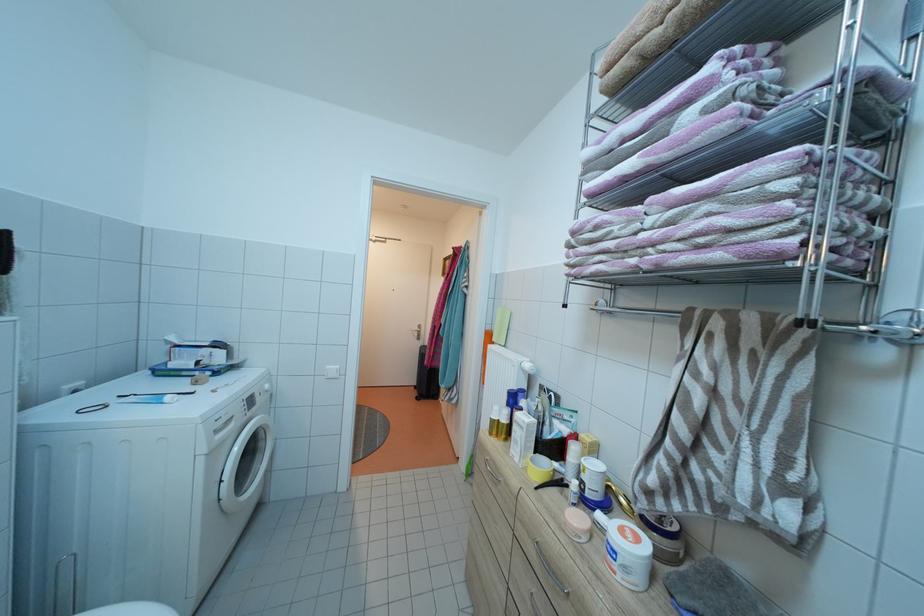
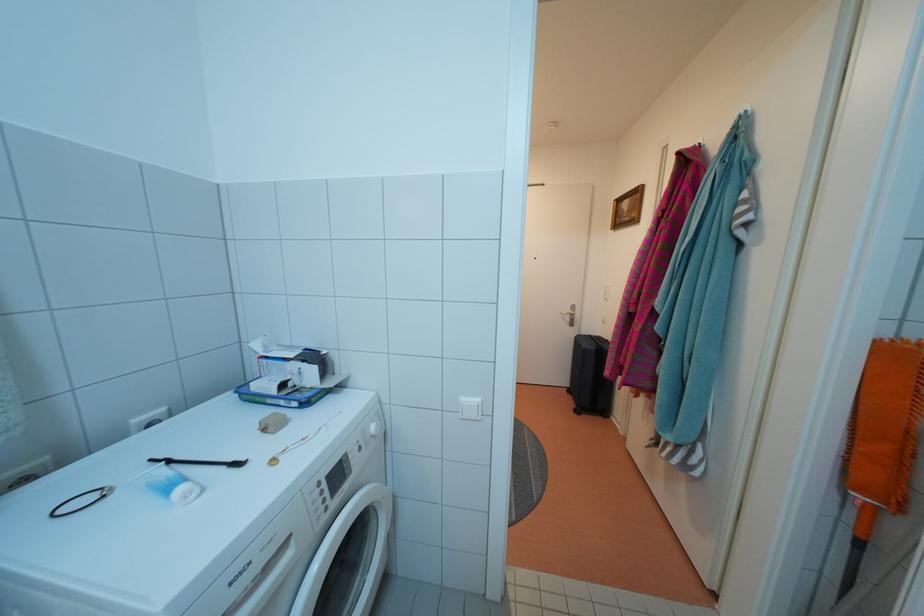
Which direction would the cameraman need to move to produce the second image?

The cameraman walked toward left, forward.